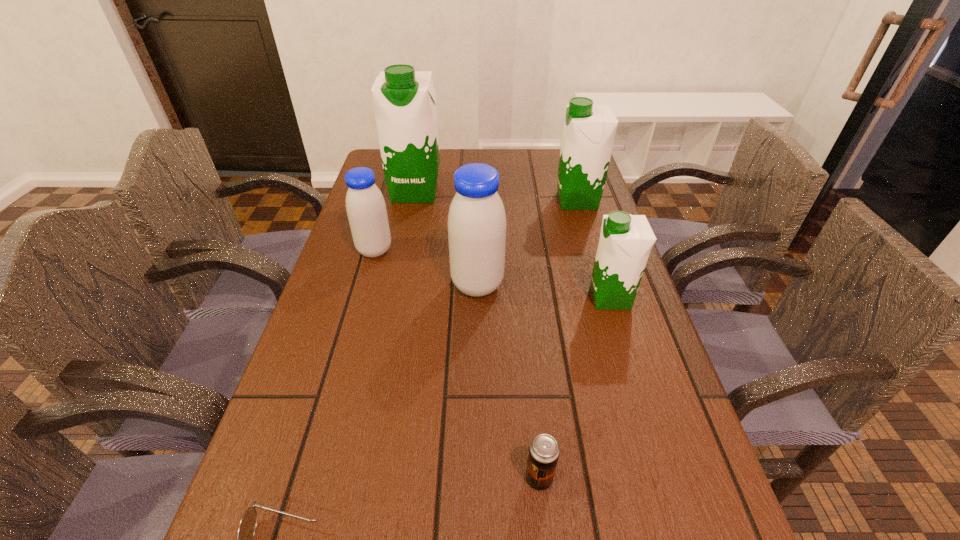
Find the location of a particular element. vacant space located 0.370m on the front-facing side of the tallest object is located at coordinates (394, 294).

Find the location of a particular element. This screenshot has width=960, height=540. vacant space situated 0.110m on the front-facing side of the second smallest green soya milk is located at coordinates (518, 201).

At what (x,y) coordinates should I click in order to perform the action: click on free location located on the front-facing side of the second smallest green soya milk. Please return your answer as a coordinate pair (x, y). The image size is (960, 540). Looking at the image, I should click on (459, 201).

Where is `vacant point located on the front-facing side of the second smallest green soya milk`? vacant point located on the front-facing side of the second smallest green soya milk is located at coordinates coord(452,201).

Where is `vacant space located on the right of the fourth object from left to right`? This screenshot has height=540, width=960. vacant space located on the right of the fourth object from left to right is located at coordinates (575, 285).

Identify the location of vacant space located on the front-facing side of the nearest green soya milk. (481, 298).

The width and height of the screenshot is (960, 540). I want to click on free region located on the front-facing side of the nearest green soya milk, so click(416, 298).

This screenshot has width=960, height=540. I want to click on free region located 0.080m on the front-facing side of the nearest green soya milk, so click(x=554, y=298).

The height and width of the screenshot is (540, 960). Find the location of `free region located 0.090m on the right of the fifth nearest object`. free region located 0.090m on the right of the fifth nearest object is located at coordinates (427, 251).

The image size is (960, 540). In order to click on vacant point located 0.190m on the back of the second shortest object in this screenshot , I will do `click(528, 370)`.